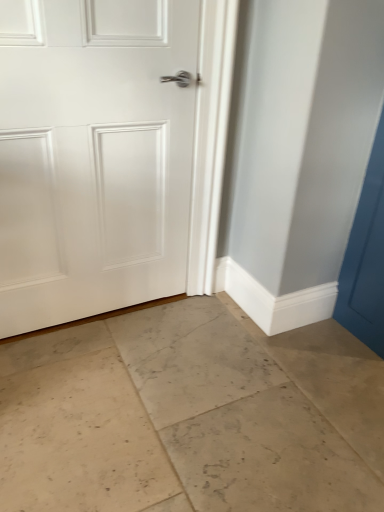
This screenshot has height=512, width=384. What do you see at coordinates (93, 156) in the screenshot?
I see `white matte door at center` at bounding box center [93, 156].

This screenshot has width=384, height=512. I want to click on white matte door at center, so click(x=93, y=156).

Find the location of a particular element. Image resolution: width=384 pixels, height=512 pixels. beige marble floor at center is located at coordinates (191, 416).

Measure the distance between point (272,409) and camera.

The depth of point (272,409) is 1.36 meters.

Describe the element at coordinates (191, 416) in the screenshot. The width and height of the screenshot is (384, 512). I see `beige marble floor at center` at that location.

Locate an element on the screen. Image resolution: width=384 pixels, height=512 pixels. white matte door at center is located at coordinates (93, 156).

Looking at this image, considering the relative positions of white matte door at center and beige marble floor at center in the image provided, is white matte door at center to the right of beige marble floor at center from the viewer's perspective?

Incorrect, white matte door at center is not on the right side of beige marble floor at center.

Relative to beige marble floor at center, is white matte door at center in front or behind?

white matte door at center is behind beige marble floor at center.

Which point is more forward, (52, 142) or (204, 340)?

The point (52, 142) is in front.

Consider the image. From the image's perspective, between white matte door at center and beige marble floor at center, which one is located above?

From the image's view, white matte door at center is above.

From a real-world perspective, between white matte door at center and beige marble floor at center, who is vertically higher?

white matte door at center.

Can you confirm if white matte door at center is wider than beige marble floor at center?

Incorrect, the width of white matte door at center does not surpass that of beige marble floor at center.

Between white matte door at center and beige marble floor at center, which one has less height?

With less height is beige marble floor at center.

Can you confirm if white matte door at center is smaller than beige marble floor at center?

Yes.

Is beige marble floor at center located within white matte door at center?

No, beige marble floor at center is not surrounded by white matte door at center.

Is white matte door at center positioned far away from beige marble floor at center?

They are positioned close to each other.

Is white matte door at center facing towards beige marble floor at center?

Yes.

The image size is (384, 512). Identify the location of door that is above the beige marble floor at center (from a real-world perspective). (93, 156).

Which object is positioned more to the left, beige marble floor at center or white matte door at center?

white matte door at center.

Is beige marble floor at center further to the viewer compared to white matte door at center?

No.

Which is less distant, (263, 487) or (27, 117)?

The point (263, 487) is closer.

From the image's perspective, which is above, beige marble floor at center or white matte door at center?

white matte door at center appears higher in the image.

From a real-world perspective, between beige marble floor at center and white matte door at center, who is vertically lower?

beige marble floor at center.

Which of these two, beige marble floor at center or white matte door at center, is thinner?

white matte door at center is thinner.

Considering the relative sizes of beige marble floor at center and white matte door at center in the image provided, is beige marble floor at center taller than white matte door at center?

In fact, beige marble floor at center may be shorter than white matte door at center.

Considering the sizes of objects beige marble floor at center and white matte door at center in the image provided, who is bigger, beige marble floor at center or white matte door at center?

Bigger between the two is beige marble floor at center.

Is beige marble floor at center positioned beyond the bounds of white matte door at center?

beige marble floor at center is positioned outside white matte door at center.

Is beige marble floor at center far from white matte door at center?

No, beige marble floor at center is not far from white matte door at center.

Is white matte door at center at the back of beige marble floor at center?

That's not correct — beige marble floor at center is not looking away from white matte door at center.

Can you tell me how much beige marble floor at center and white matte door at center differ in facing direction?

The angular difference between beige marble floor at center and white matte door at center is 90.4 degrees.

Measure the distance from beige marble floor at center to white matte door at center.

They are 62.73 centimeters apart.

In the image, there is a white matte door at center. Where is `concrete below it (from a real-world perspective)`? The height and width of the screenshot is (512, 384). concrete below it (from a real-world perspective) is located at coordinates pos(191,416).

The height and width of the screenshot is (512, 384). I want to click on concrete in front of the white matte door at center, so click(x=191, y=416).

At what (x,y) coordinates should I click in order to perform the action: click on concrete beneath the white matte door at center (from a real-world perspective). Please return your answer as a coordinate pair (x, y). Looking at the image, I should click on (191, 416).